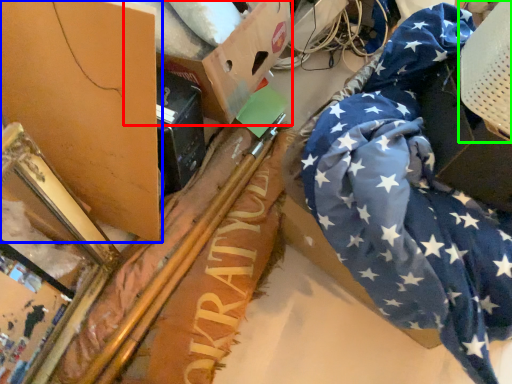
Question: Based on their relative distances, which object is farther from cardboard box (highlighted by a red box)? Choose from cardboard box (highlighted by a blue box) and swivel chair (highlighted by a green box).

Choices:
 (A) cardboard box
 (B) swivel chair

Answer: (B)